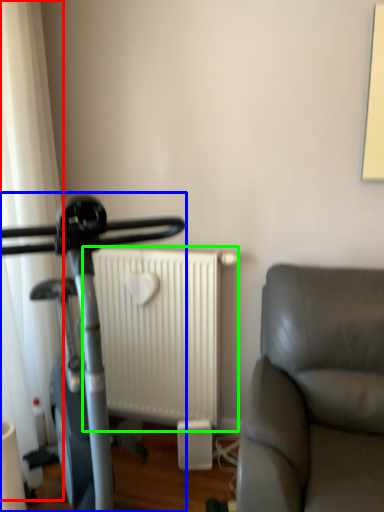
Question: Which is farther away from curtain (highlighted by a red box)? stationary bicycle (highlighted by a blue box) or radiator (highlighted by a green box)?

Choices:
 (A) stationary bicycle
 (B) radiator

Answer: (B)